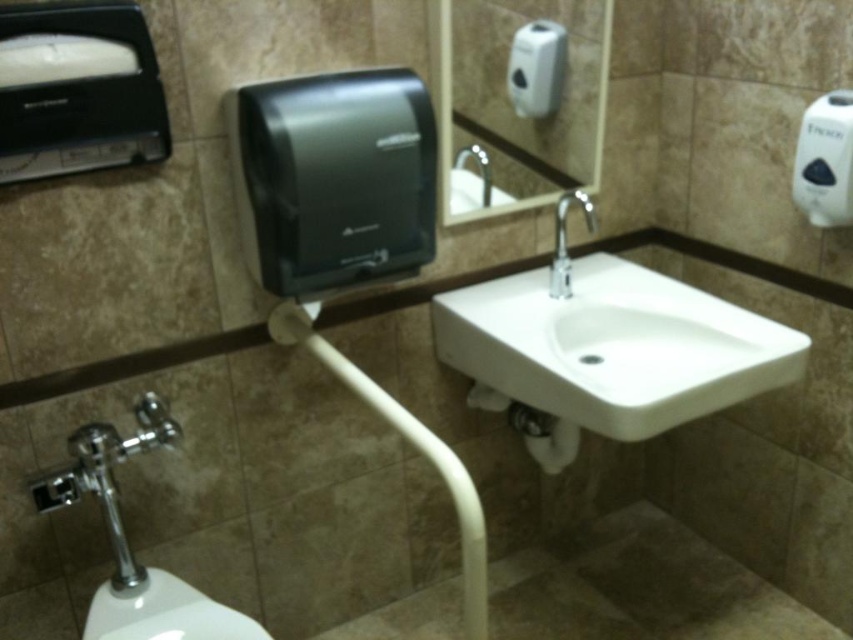
Who is shorter, black plastic hand dryer at upper left or matte black hand dryer at upper left?

matte black hand dryer at upper left

Can you confirm if black plastic hand dryer at upper left is smaller than matte black hand dryer at upper left?

Actually, black plastic hand dryer at upper left might be larger than matte black hand dryer at upper left.

The width and height of the screenshot is (853, 640). What do you see at coordinates (334, 179) in the screenshot?
I see `black plastic hand dryer at upper left` at bounding box center [334, 179].

Where is `black plastic hand dryer at upper left`? This screenshot has width=853, height=640. black plastic hand dryer at upper left is located at coordinates (334, 179).

Is white glossy sink at center wider than black plastic hand dryer at upper left?

Indeed, white glossy sink at center has a greater width compared to black plastic hand dryer at upper left.

Describe the element at coordinates (610, 344) in the screenshot. I see `white glossy sink at center` at that location.

Identify the location of white glossy sink at center. (610, 344).

Can you confirm if black plastic hand dryer at upper left is positioned above silver metallic faucet at center?

Correct, black plastic hand dryer at upper left is located above silver metallic faucet at center.

Is black plastic hand dryer at upper left in front of silver metallic faucet at center?

Yes, black plastic hand dryer at upper left is in front of silver metallic faucet at center.

The height and width of the screenshot is (640, 853). What do you see at coordinates (334, 179) in the screenshot?
I see `black plastic hand dryer at upper left` at bounding box center [334, 179].

Identify the location of black plastic hand dryer at upper left. (334, 179).